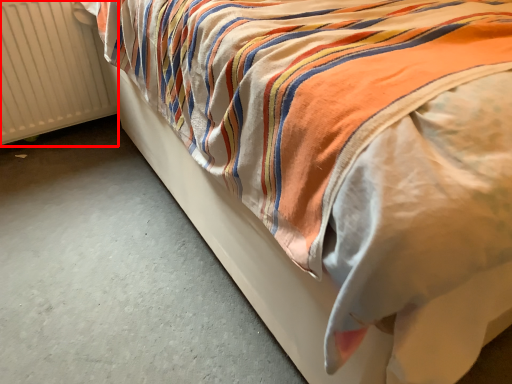
Question: Considering the relative positions of radiator (annotated by the red box) and concrete in the image provided, where is radiator (annotated by the red box) located with respect to the staircase?

Choices:
 (A) right
 (B) left

Answer: (B)